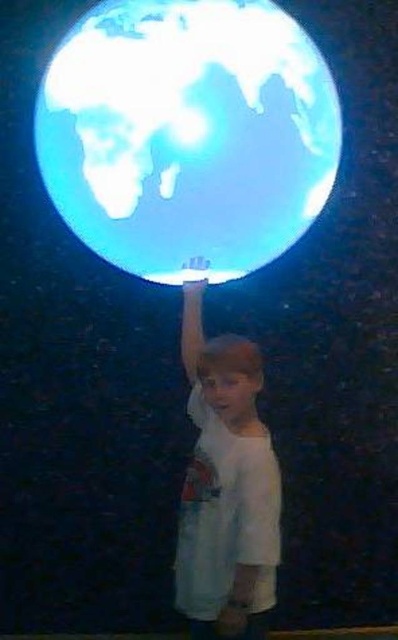
You are a photographer trying to capture the perfect shot of the scene. You notice two points in the image at coordinates point (91, 65) and point (202, 464). Which point should you focus on to ensure the subject is sharp if you want to highlight the closest object to the camera?

You should focus on point (91, 65) because it is closer to the camera than point (202, 464), ensuring the closest object is sharp.

You are a photographer setting up for a photo shoot. The subject is the child holding the transparent glass globe at upper center and wearing the white cotton shirt at center. You need to ensure that the distance between the globe and the shirt is exactly 25 inches for proper lighting. Based on the scene, is the current distance sufficient?

The transparent glass globe at upper center is 25.09 inches away from the white cotton shirt at center, which is just slightly over the required 25 inches. The distance is sufficient as it meets the requirement closely.

You are a photographer aiming to capture a closeup shot of the transparent glass globe at upper center. Given that your camera can focus on objects within 2 meters, will you be able to take the photo without moving closer?

The transparent glass globe at upper center is 2.44 meters away from the camera, which is beyond the camera focus range of 2 meters. Therefore, you cannot take the photo without moving closer.